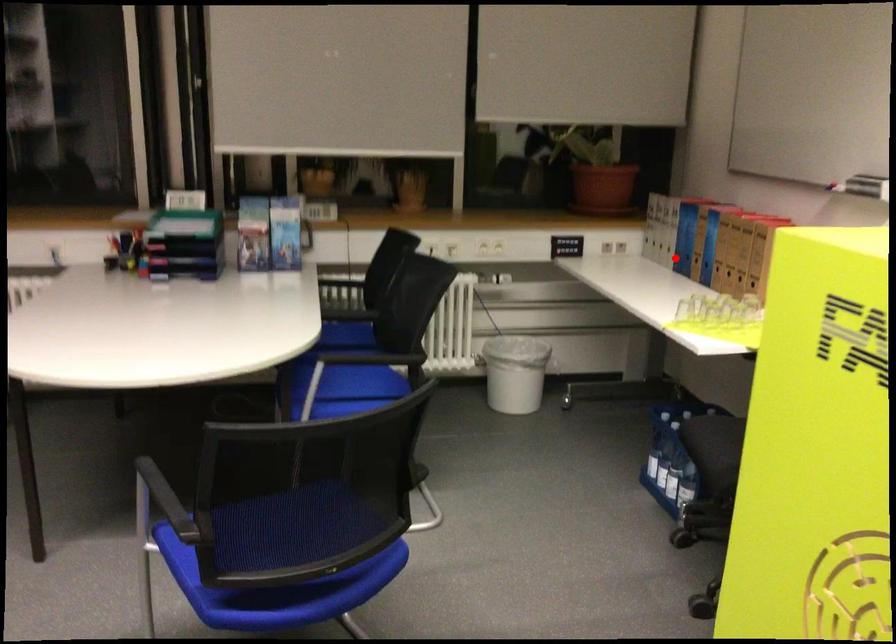
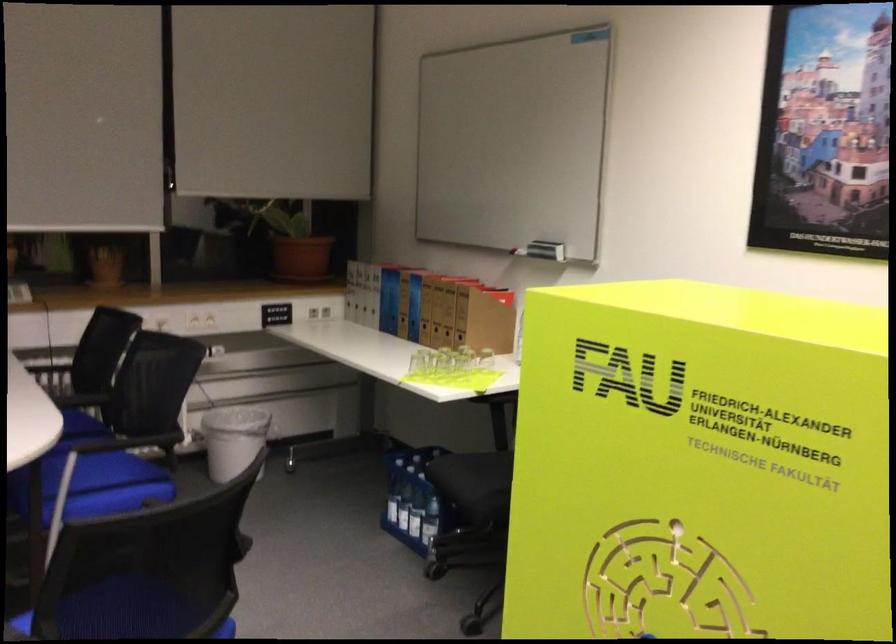
Find the pixel in the second image that matches the highlighted location in the first image.

(382, 321)